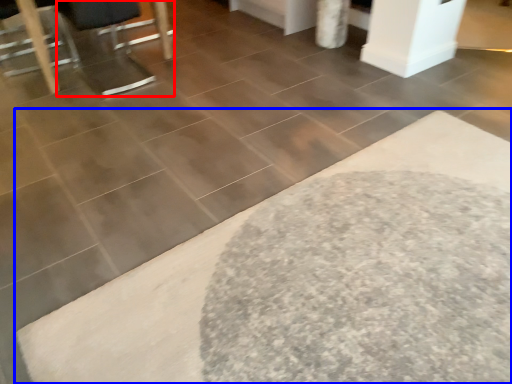
Question: Which object is further to the camera taking this photo, swivel chair (highlighted by a red box) or bath mat (highlighted by a blue box)?

Choices:
 (A) swivel chair
 (B) bath mat

Answer: (A)